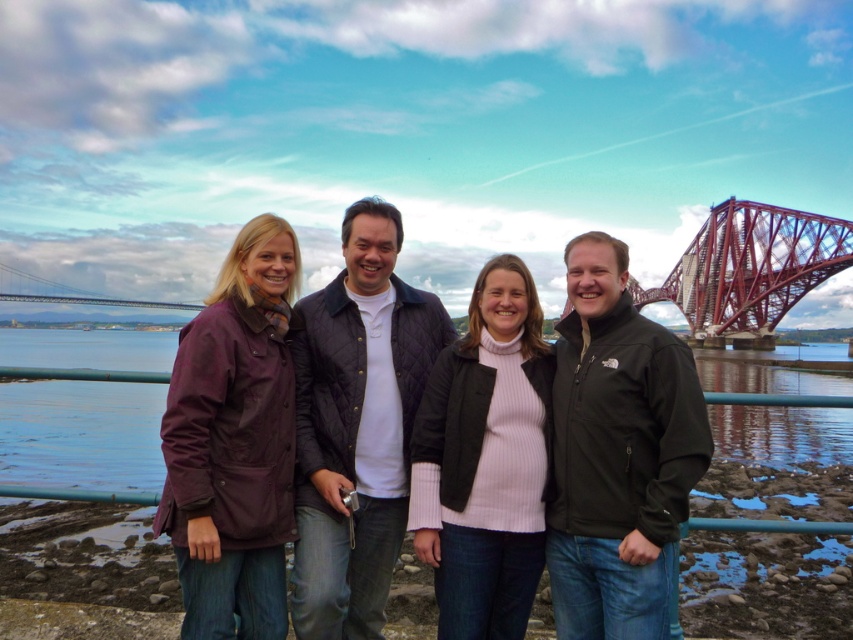
You are a photographer trying to capture a photo of the red metal bridge at upper right without any people in the frame. Currently, you see the matte purple jacket at center blocking the view. Can you adjust your position to take the photo without the jacket blocking the bridge?

The matte purple jacket at center is in front of the red metal bridge at upper right, so moving your position to either side of the jacket would allow you to capture the bridge without obstruction.

You are a photographer trying to capture a photo of the red metal bridge at upper right. However, there is a person wearing a matte purple jacket at center blocking your view. Can you estimate whether the person is smaller in size compared to the bridge in the image?

The matte purple jacket at center occupies less space than the red metal bridge at upper right, so yes, the person wearing the matte purple jacket at center is smaller in size compared to the red metal bridge at upper right in the image.

You are a photographer positioned at the camera location. You want to capture a closeup shot of the matte purple jacket at center. Given that your camera has a maximum zoom range of 100 meters, can you achieve this?

The matte purple jacket at center is 73.65 meters away from the camera. Since the camera can zoom up to 100 meters, you can achieve the closeup shot.